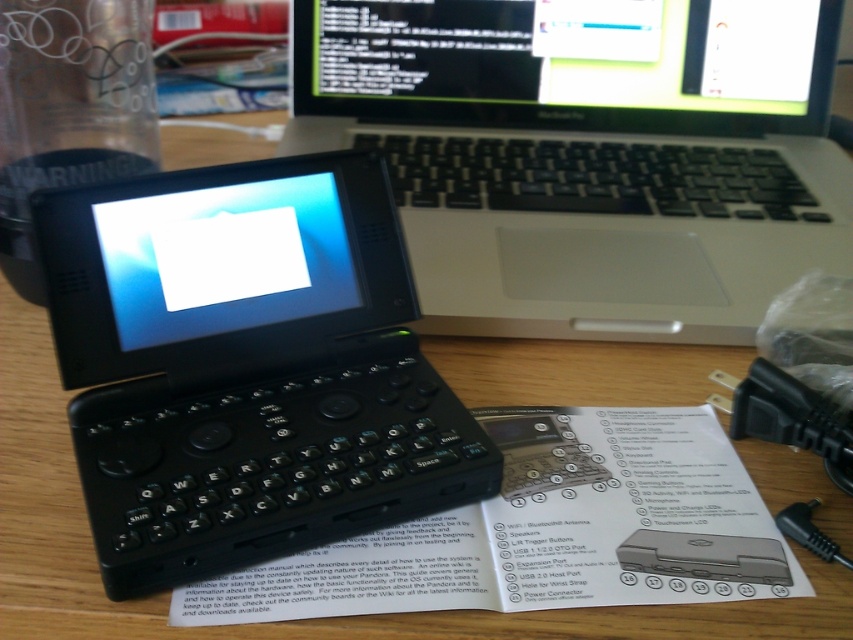
Question: Which of the following is the farthest from the observer?

Choices:
 (A) (653, 16)
 (B) (704, 173)
 (C) (293, 305)
 (D) (772, 552)

Answer: (A)

Question: Is black plastic laptop at upper center below white paper at center?

Choices:
 (A) no
 (B) yes

Answer: (A)

Question: Does black plastic laptop at upper center lie behind black plastic keyboard at center?

Choices:
 (A) yes
 (B) no

Answer: (B)

Question: Which object is positioned closest to the white paper at center?

Choices:
 (A) black plastic handheld device at center-left
 (B) black plastic laptop at upper center
 (C) black plastic keyboard at center
 (D) slate gray plastic smartphone at center

Answer: (D)

Question: Which point appears farthest from the camera in this image?

Choices:
 (A) 531,189
 (B) 735,584
 (C) 643,531

Answer: (A)

Question: Is black plastic handheld device at center-left thinner than black plastic keyboard at center?

Choices:
 (A) no
 (B) yes

Answer: (B)